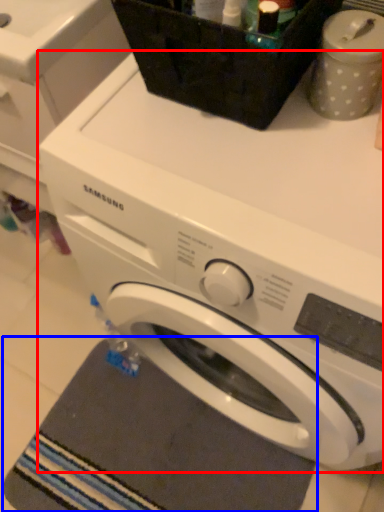
Question: Among these objects, which one is nearest to the camera, washing machine (highlighted by a red box) or bath mat (highlighted by a blue box)?

Choices:
 (A) washing machine
 (B) bath mat

Answer: (A)